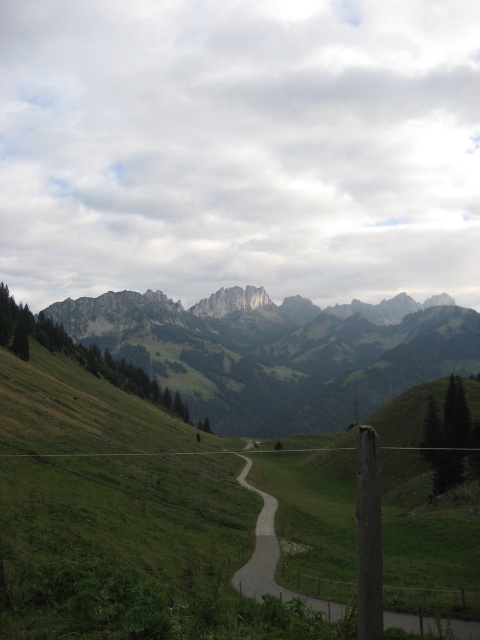
Question: Among these objects, which one is nearest to the camera?

Choices:
 (A) rugged stone mountains at upper center
 (B) gray asphalt road at center

Answer: (B)

Question: Does rugged stone mountains at upper center appear under gray asphalt road at center?

Choices:
 (A) no
 (B) yes

Answer: (A)

Question: Is rugged stone mountains at upper center positioned at the back of gray asphalt road at center?

Choices:
 (A) yes
 (B) no

Answer: (A)

Question: Which point is closer to the camera?

Choices:
 (A) gray asphalt road at center
 (B) rugged stone mountains at upper center

Answer: (A)

Question: Does rugged stone mountains at upper center come in front of gray asphalt road at center?

Choices:
 (A) yes
 (B) no

Answer: (B)